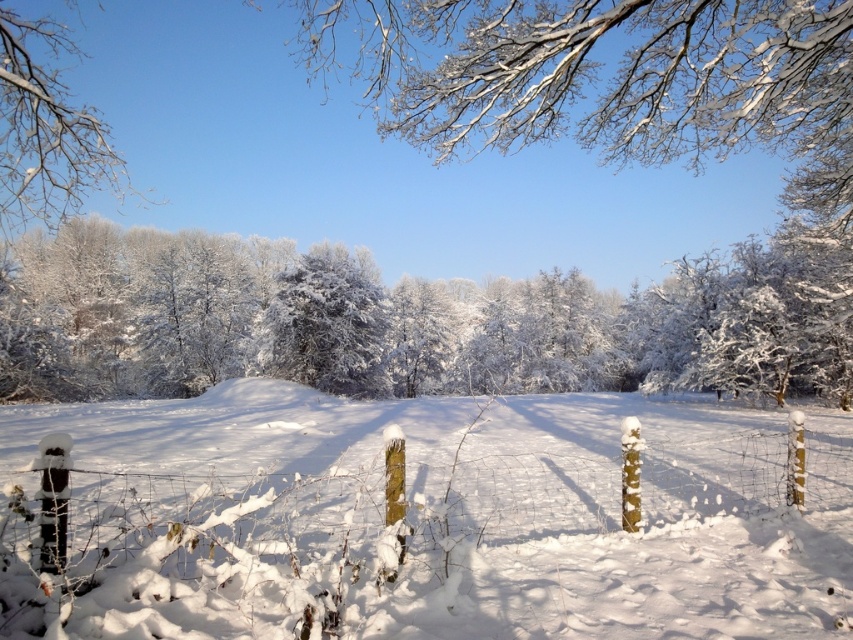
You are an observer standing in the winter landscape. You notice the white frosty trees at center and the white frosty branches at upper left. Which one appears closer to you based on their sizes?

The white frosty trees at center appears closer because it is smaller than the white frosty branches at upper left. In perspective, smaller objects can appear closer if they are actually farther away, but in this case, since the trees are at the center and the branches are at the upper left, the size difference might indicate the trees are closer. Wait, this is confusing. Let me think again. The description says the trees at center are smaller than the branches at upper left. Hmm, perspective usually makes